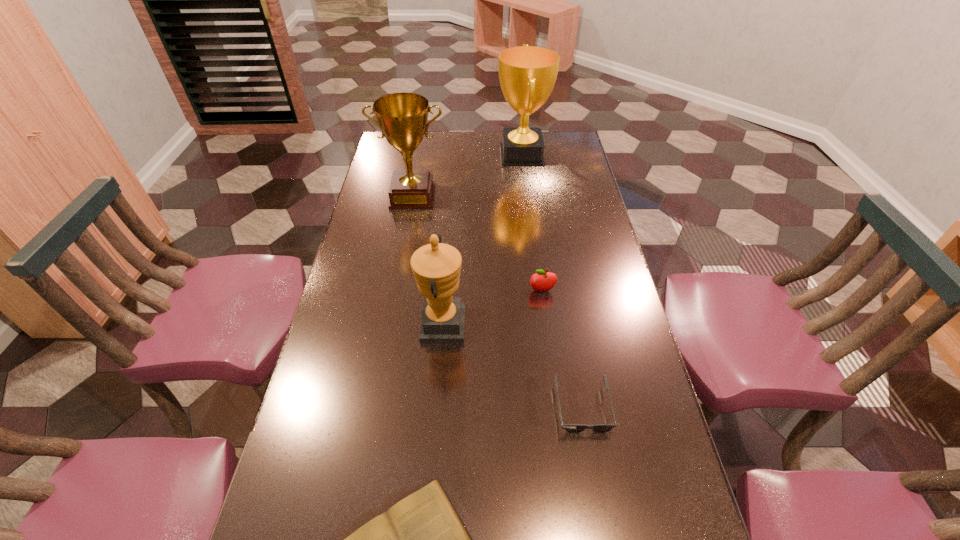
The image size is (960, 540). Identify the location of vacant space situated 0.240m on the front-facing side of the farthest award. (439, 155).

Find the location of a particular element. The image size is (960, 540). free spot located on the plaque of the fifth nearest object is located at coordinates (409, 219).

Find the location of `vacant space located at the front of the nearest award with handles`. vacant space located at the front of the nearest award with handles is located at coordinates point(610,326).

Locate an element on the screen. The width and height of the screenshot is (960, 540). vacant area located on the back of the third farthest object is located at coordinates (536, 244).

The height and width of the screenshot is (540, 960). I want to click on vacant space located on the temples of the fifth tallest object, so click(599, 506).

This screenshot has width=960, height=540. In order to click on object that is at the far edge in this screenshot , I will do `click(527, 74)`.

At what (x,y) coordinates should I click in order to perform the action: click on object that is at the left edge. Please return your answer as a coordinate pair (x, y). Looking at the image, I should click on (402, 117).

I want to click on award that is at the right edge, so click(527, 74).

Where is `sunglasses located in the right edge section of the desktop`? sunglasses located in the right edge section of the desktop is located at coordinates (571, 428).

Identify the location of object located at the far right corner. (527, 74).